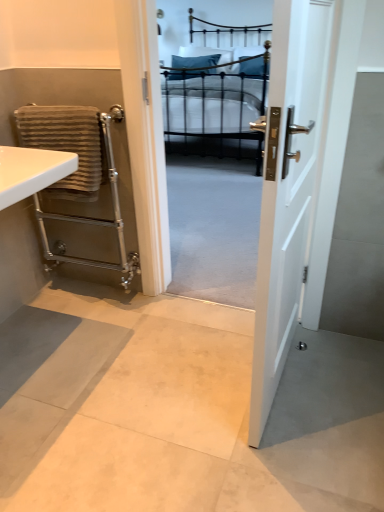
Question: From a real-world perspective, is brown striped towel at left positioned above or below black metal bed at center?

Choices:
 (A) above
 (B) below

Answer: (A)

Question: Is brown striped towel at left taller or shorter than black metal bed at center?

Choices:
 (A) tall
 (B) short

Answer: (B)

Question: Based on their relative distances, which object is farther from the blue fabric pillow at center?

Choices:
 (A) white glossy sink at left
 (B) brown striped towel at left
 (C) black metal bed at center
 (D) silver metallic towel rail at left
 (E) white glossy door at center

Answer: (E)

Question: Which object is the closest to the white glossy door at center?

Choices:
 (A) brown striped towel at left
 (B) blue fabric pillow at center
 (C) black metal bed at center
 (D) white glossy sink at left
 (E) silver metallic towel rail at left

Answer: (D)